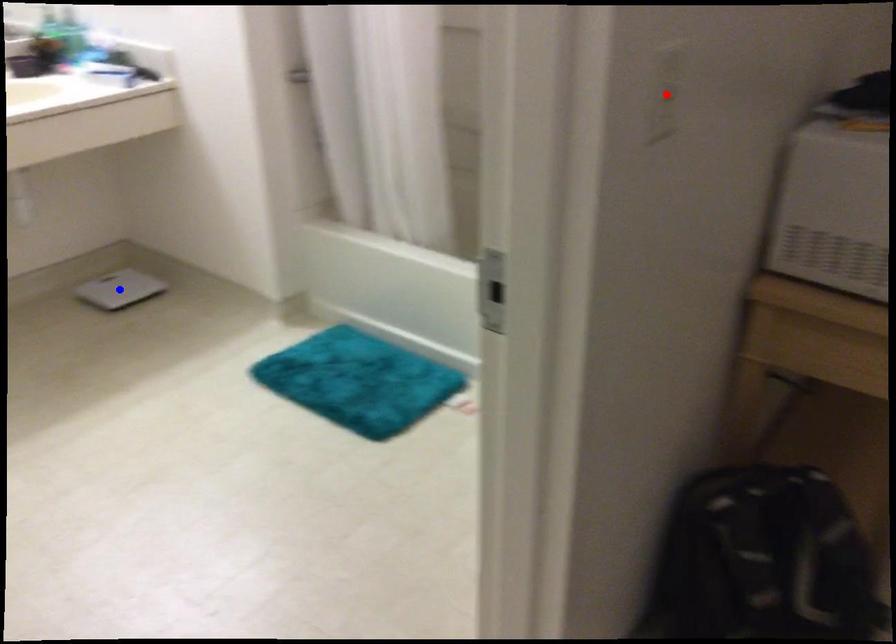
Question: In the image, two points are highlighted. Which point is nearer to the camera? Reply with the corresponding letter.

Choices:
 (A) blue point
 (B) red point

Answer: (B)